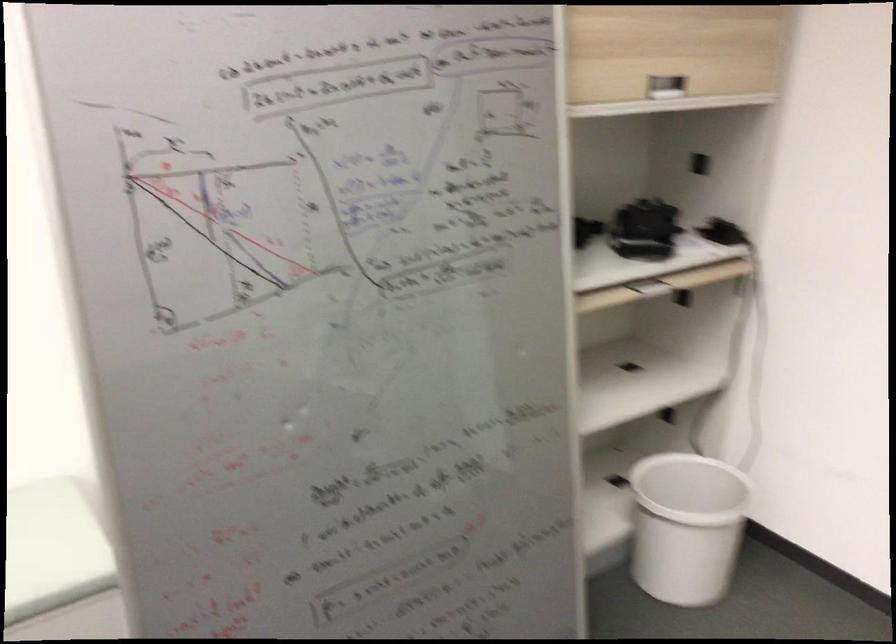
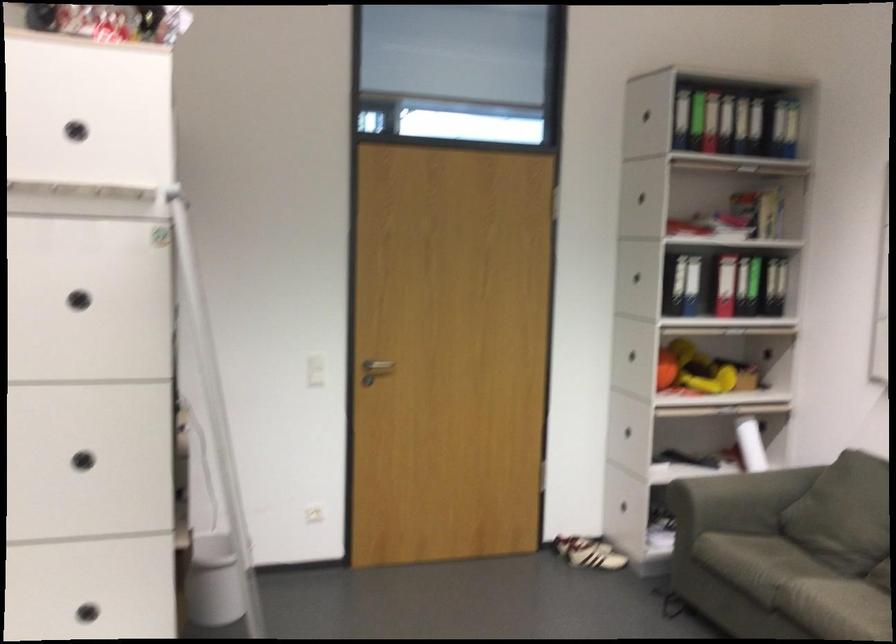
In the second image, find the point that corresponds to the point at 725,570 in the first image.

(213, 581)